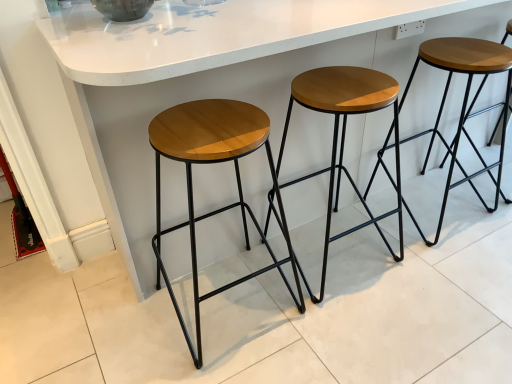
Question: In the image, is wooden/matte stool at center, acting as the second stool starting from the right, on the left side or the right side of wooden/matte stool at center, placed as the first stool when sorted from left to right?

Choices:
 (A) left
 (B) right

Answer: (B)

Question: In terms of size, does wooden/matte stool at center, marked as the 2th stool in a left-to-right arrangement, appear bigger or smaller than wooden/matte stool at center, placed as the first stool when sorted from left to right?

Choices:
 (A) big
 (B) small

Answer: (B)

Question: Based on their relative distances, which object is farther from the wooden/matte stool at center, placed as the first stool when sorted from left to right?

Choices:
 (A) wooden seat at center, acting as the 3th stool starting from the left
 (B) white glossy counter at center
 (C) wooden/matte stool at center, acting as the second stool starting from the right

Answer: (A)

Question: Based on their relative distances, which object is farther from the wooden/matte stool at center, placed as the first stool when sorted from left to right?

Choices:
 (A) wooden seat at center, arranged as the 1th stool when viewed from the right
 (B) white glossy counter at center
 (C) wooden/matte stool at center, marked as the 2th stool in a left-to-right arrangement

Answer: (A)